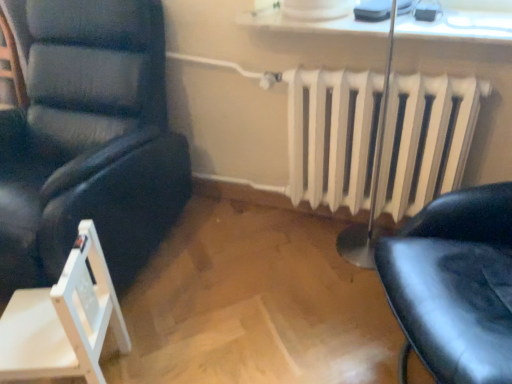
Question: Is matte black chair at left, which is counted as the first chair, starting from the top, wider than white glossy window sill at upper center?

Choices:
 (A) no
 (B) yes

Answer: (B)

Question: From the image's perspective, is matte black chair at left, which is the 2th chair in bottom-to-top order, over white glossy window sill at upper center?

Choices:
 (A) no
 (B) yes

Answer: (A)

Question: Is matte black chair at left, which is counted as the first chair, starting from the top, completely or partially outside of white glossy window sill at upper center?

Choices:
 (A) no
 (B) yes

Answer: (B)

Question: Is matte black chair at left, which is the 2th chair in bottom-to-top order, looking in the opposite direction of white glossy window sill at upper center?

Choices:
 (A) yes
 (B) no

Answer: (B)

Question: Can you confirm if matte black chair at left, which is the 2th chair in bottom-to-top order, is positioned to the right of white glossy window sill at upper center?

Choices:
 (A) yes
 (B) no

Answer: (B)

Question: Is point (315, 74) closer or farther from the camera than point (436, 13)?

Choices:
 (A) closer
 (B) farther

Answer: (B)

Question: Considering their positions, is white painted metal radiator at center located in front of or behind white glossy window sill at upper center?

Choices:
 (A) behind
 (B) front

Answer: (A)

Question: Based on their positions, is white painted metal radiator at center located to the left or right of white glossy window sill at upper center?

Choices:
 (A) left
 (B) right

Answer: (B)

Question: In terms of height, does white painted metal radiator at center look taller or shorter compared to white glossy window sill at upper center?

Choices:
 (A) tall
 (B) short

Answer: (A)

Question: Is white glossy window sill at upper center situated inside white wood folding chair at lower left, marked as the second chair in a top-to-bottom arrangement, or outside?

Choices:
 (A) outside
 (B) inside

Answer: (A)

Question: Does point click(322, 21) appear closer or farther from the camera than point click(12, 311)?

Choices:
 (A) farther
 (B) closer

Answer: (A)

Question: Based on their positions, is white glossy window sill at upper center located to the left or right of white wood folding chair at lower left, marked as the second chair in a top-to-bottom arrangement?

Choices:
 (A) left
 (B) right

Answer: (B)

Question: From the image's perspective, is white glossy window sill at upper center positioned above or below white wood folding chair at lower left, marked as the second chair in a top-to-bottom arrangement?

Choices:
 (A) above
 (B) below

Answer: (A)

Question: Is white glossy window sill at upper center taller or shorter than matte black chair at left, which is the 2th chair in bottom-to-top order?

Choices:
 (A) short
 (B) tall

Answer: (A)

Question: From a real-world perspective, is white glossy window sill at upper center positioned above or below matte black chair at left, which is the 2th chair in bottom-to-top order?

Choices:
 (A) below
 (B) above

Answer: (B)